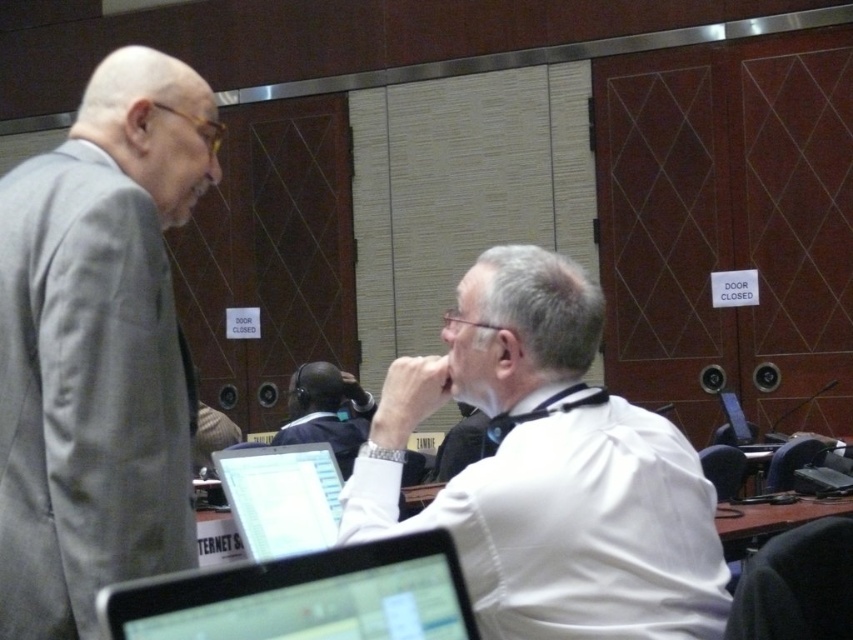
You are attending a meeting in this conference room and notice two people at the center wearing white shirt at center and dark blue shirt at center. Which one is closer to you?

The white shirt at center is closer to the viewer than the dark blue shirt at center.

You are organizing a photo shoot in this conference room and need to position two actors wearing the white shirt at center and dark blue shirt at center. Since space is limited, you want to ensure that the larger actor can fit comfortably. Which actor should be placed in the spot where there is only enough space for a larger person?

The white shirt at center is bigger than the dark blue shirt at center, so the actor wearing the white shirt at center should be placed in the spot with space for a larger person.